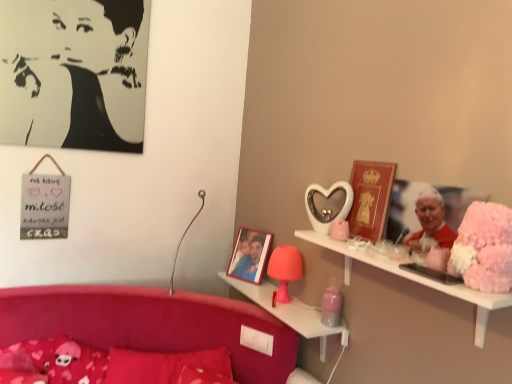
Question: Considering the relative positions of matte pink plastic table lamp at center, which appears as the 2th table lamp when viewed from the left, and velvet red pillow at lower left, the 2th pillow viewed from the left, in the image provided, is matte pink plastic table lamp at center, which appears as the 2th table lamp when viewed from the left, to the left of velvet red pillow at lower left, the 2th pillow viewed from the left, from the viewer's perspective?

Choices:
 (A) no
 (B) yes

Answer: (A)

Question: From a real-world perspective, is matte pink plastic table lamp at center, the first table lamp viewed from the right, below velvet red pillow at lower left, positioned as the 1th pillow in right-to-left order?

Choices:
 (A) yes
 (B) no

Answer: (B)

Question: Is matte pink plastic table lamp at center, the first table lamp viewed from the right, wider than velvet red pillow at lower left, positioned as the 1th pillow in right-to-left order?

Choices:
 (A) yes
 (B) no

Answer: (B)

Question: Is matte pink plastic table lamp at center, which appears as the 2th table lamp when viewed from the left, surrounding velvet red pillow at lower left, the 2th pillow viewed from the left?

Choices:
 (A) no
 (B) yes

Answer: (A)

Question: From the image's perspective, is matte pink plastic table lamp at center, the first table lamp viewed from the right, on top of velvet red pillow at lower left, positioned as the 1th pillow in right-to-left order?

Choices:
 (A) yes
 (B) no

Answer: (A)

Question: Does matte pink plastic table lamp at center, the first table lamp viewed from the right, lie in front of velvet red pillow at lower left, the 2th pillow viewed from the left?

Choices:
 (A) no
 (B) yes

Answer: (A)

Question: From the image's perspective, would you say velvet red pillow at lower left, positioned as the 1th pillow in right-to-left order, is shown under black paper portrait at upper left?

Choices:
 (A) no
 (B) yes

Answer: (B)

Question: From a real-world perspective, is velvet red pillow at lower left, the 2th pillow viewed from the left, located beneath black paper portrait at upper left?

Choices:
 (A) yes
 (B) no

Answer: (A)

Question: Considering the relative sizes of velvet red pillow at lower left, positioned as the 1th pillow in right-to-left order, and black paper portrait at upper left in the image provided, is velvet red pillow at lower left, positioned as the 1th pillow in right-to-left order, smaller than black paper portrait at upper left?

Choices:
 (A) no
 (B) yes

Answer: (A)

Question: Considering the relative sizes of velvet red pillow at lower left, positioned as the 1th pillow in right-to-left order, and black paper portrait at upper left in the image provided, is velvet red pillow at lower left, positioned as the 1th pillow in right-to-left order, wider than black paper portrait at upper left?

Choices:
 (A) no
 (B) yes

Answer: (B)

Question: Considering the relative sizes of velvet red pillow at lower left, the 2th pillow viewed from the left, and black paper portrait at upper left in the image provided, is velvet red pillow at lower left, the 2th pillow viewed from the left, thinner than black paper portrait at upper left?

Choices:
 (A) yes
 (B) no

Answer: (B)

Question: From the image's perspective, is velvet red pillow at lower left, the 2th pillow viewed from the left, located above black paper portrait at upper left?

Choices:
 (A) yes
 (B) no

Answer: (B)

Question: Is metallic silver table lamp at center, which is the second table lamp from right to left, to the right of black paper portrait at upper left from the viewer's perspective?

Choices:
 (A) no
 (B) yes

Answer: (B)